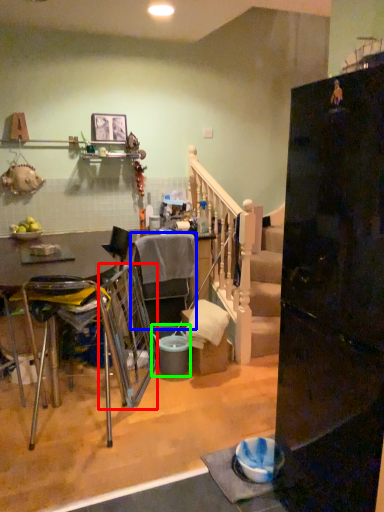
Question: Based on their relative distances, which object is farther from swivel chair (highlighted by a red box)? Choose from chair (highlighted by a blue box) and bucket (highlighted by a green box).

Choices:
 (A) chair
 (B) bucket

Answer: (A)